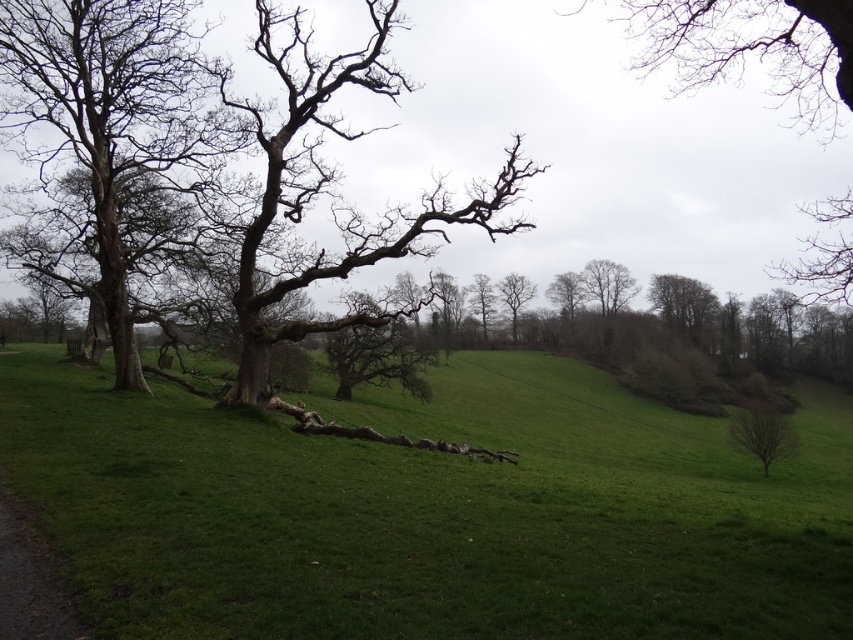
You are standing in the middle of the open landscape and want to take a photo of the bare branches at left. Where should you position yourself to capture the branches in the frame?

You should position yourself to the right of the bare branches at left to capture them in the frame, as they are located at point [216,147].